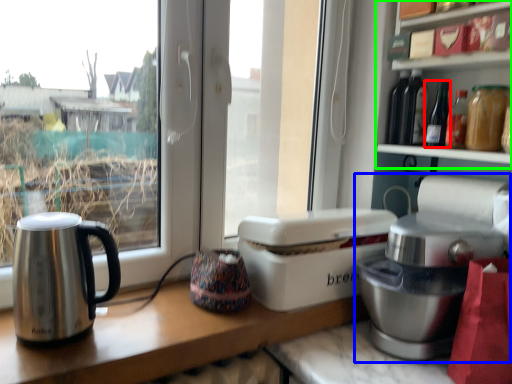
Question: Considering the real-world distances, which object is farthest from bottle (highlighted by a red box)? home appliance (highlighted by a blue box) or shelf (highlighted by a green box)?

Choices:
 (A) home appliance
 (B) shelf

Answer: (A)